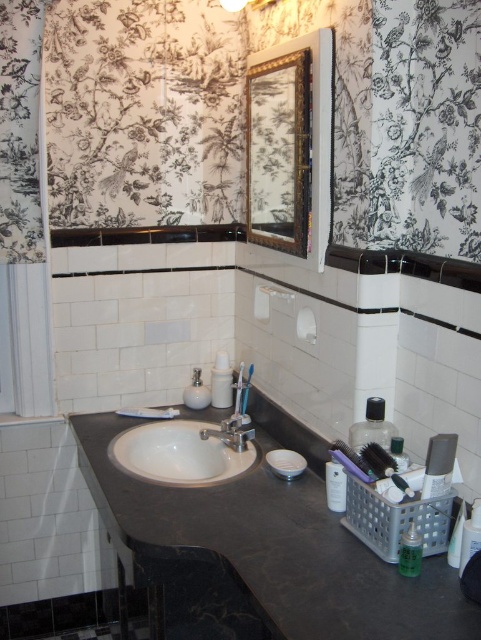
You are organizing your bathroom and want to store a tall hairbrush. You have two containers available. Which container, the clear plastic container at right or the translucent plastic container at center, is better suited for storing the tall hairbrush?

The clear plastic container at right is much taller than the translucent plastic container at center, so it is better suited for storing the tall hairbrush.

You are organizing your bathroom and want to place the translucent plastic bottle at lower right and the translucent plastic container at center into a drawer. The drawer has a width of 10 cm. Which item will fit better in the drawer based on their widths?

The translucent plastic bottle at lower right is thinner than the translucent plastic container at center, so it will fit better in the 10 cm wide drawer.

You are organizing your bathroom and want to place the translucent plastic container at center on top of the translucent plastic bottle at lower right. Will the container fit on top of the bottle?

The translucent plastic bottle at lower right is taller than the translucent plastic container at center. Since the bottle is taller, it might have a larger base, but the container could still fit depending on the diameter. However, the height difference alone doesn